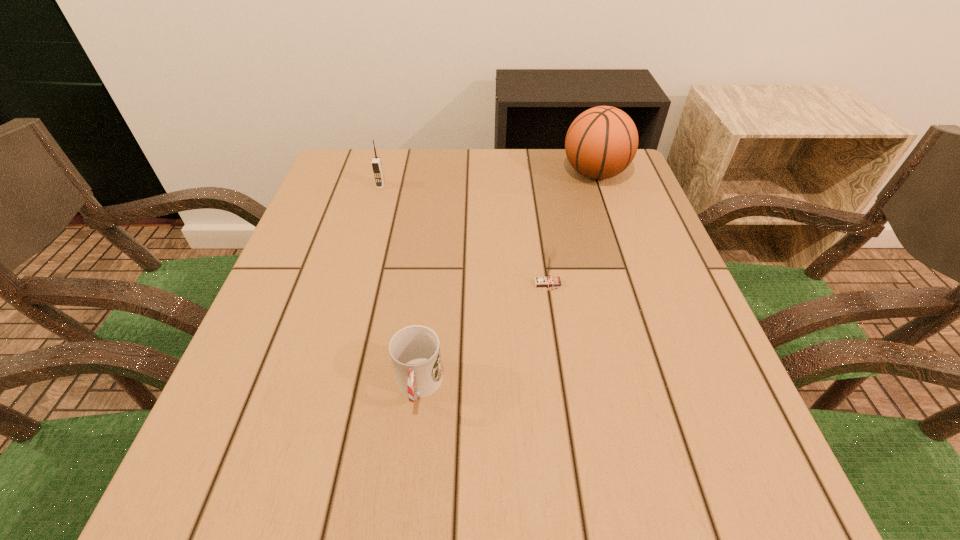
Locate an element on the screen. This screenshot has height=540, width=960. vacant space at the right edge of the desktop is located at coordinates (701, 339).

Where is `free space between the tallest object and the third farthest object`? This screenshot has width=960, height=540. free space between the tallest object and the third farthest object is located at coordinates (571, 229).

This screenshot has width=960, height=540. Identify the location of free area in between the third object from left to right and the nearest object. (483, 335).

Image resolution: width=960 pixels, height=540 pixels. Find the location of `vacant space that's between the matchbox and the rightmost object`. vacant space that's between the matchbox and the rightmost object is located at coordinates (571, 229).

Find the location of a particular element. free space between the cup and the third shortest object is located at coordinates (399, 286).

Find the location of a particular element. The width and height of the screenshot is (960, 540). free space between the third object from right to left and the second tallest object is located at coordinates (399, 286).

Identify the location of unoccupied position between the nearest object and the second object from right to left. (483, 335).

Image resolution: width=960 pixels, height=540 pixels. What are the coordinates of `free space between the second object from right to left and the third shortest object` in the screenshot? It's located at (464, 235).

The width and height of the screenshot is (960, 540). Identify the location of unoccupied area between the second tallest object and the cup. (399, 286).

The height and width of the screenshot is (540, 960). Find the location of `free space between the matchbox and the leftmost object`. free space between the matchbox and the leftmost object is located at coordinates (464, 235).